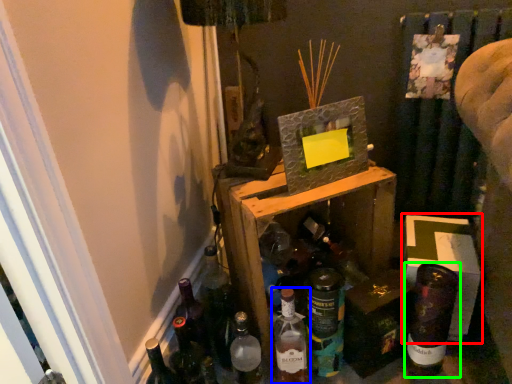
Question: Estimate the real-world distances between objects in this image. Which object is closer to cardboard box (highlighted by a red box), bottle (highlighted by a blue box) or bottle (highlighted by a green box)?

Choices:
 (A) bottle
 (B) bottle

Answer: (B)